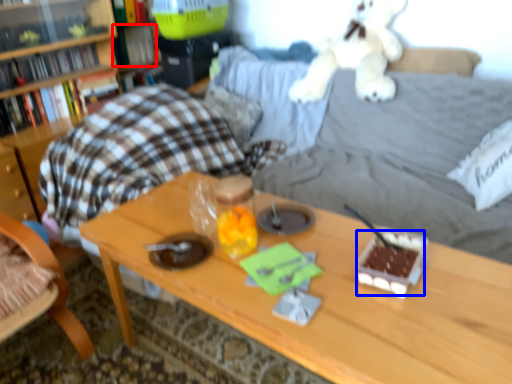
Question: Among these objects, which one is farthest to the camera, book (highlighted by a red box) or food (highlighted by a blue box)?

Choices:
 (A) book
 (B) food

Answer: (A)